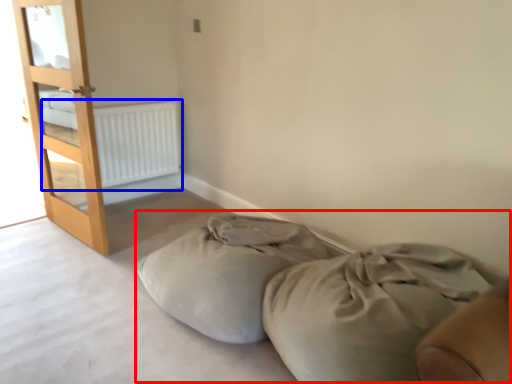
Question: Which point is closer to the camera, bed frame (highlighted by a red box) or radiator (highlighted by a blue box)?

Choices:
 (A) bed frame
 (B) radiator

Answer: (A)